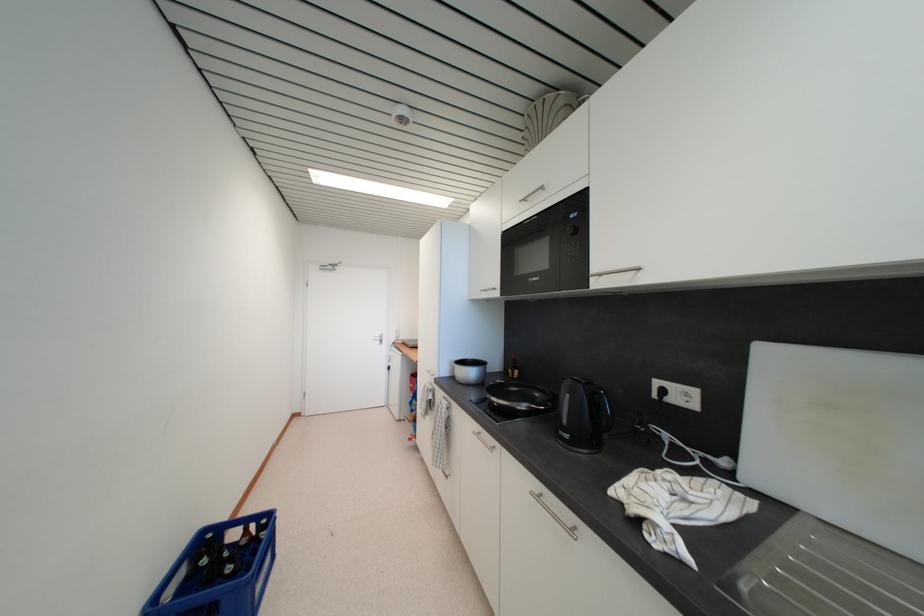
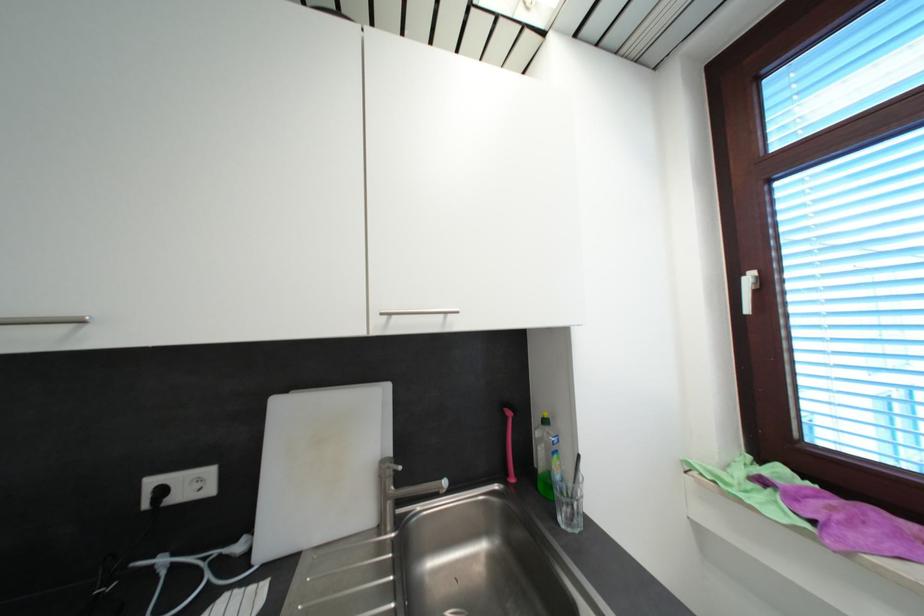
Question: The camera is either moving clockwise (left) or counter-clockwise (right) around the object. The first image is from the beginning of the video and the second image is from the end. Is the camera moving left or right when shooting the video?

Choices:
 (A) Left
 (B) Right

Answer: (A)